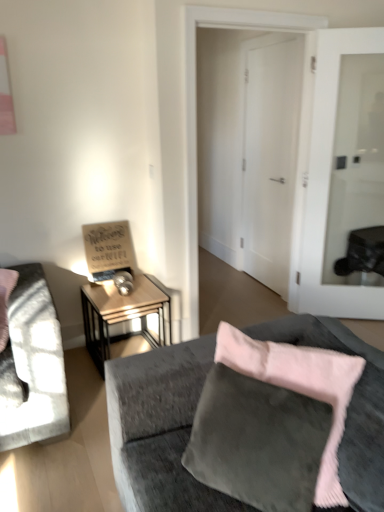
Identify the location of vacant area that lies to the right of metallic silver table lamp at left. The width and height of the screenshot is (384, 512). (137, 287).